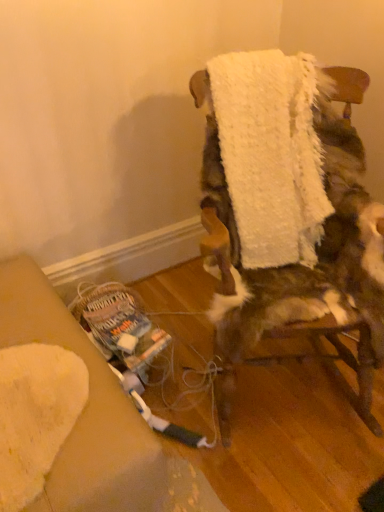
Identify the location of white fluffy chair at center. This screenshot has height=512, width=384. (299, 264).

Describe the element at coordinates (299, 264) in the screenshot. This screenshot has width=384, height=512. I see `white fluffy chair at center` at that location.

Describe the element at coordinates (271, 154) in the screenshot. This screenshot has width=384, height=512. I see `white fluffy towel at center` at that location.

Locate an element on the screen. The width and height of the screenshot is (384, 512). white fluffy towel at center is located at coordinates (271, 154).

Image resolution: width=384 pixels, height=512 pixels. In order to click on white fluffy chair at center in this screenshot , I will do `click(299, 264)`.

Is white fluffy chair at center to the left or to the right of white fluffy towel at center in the image?

From the image, it's evident that white fluffy chair at center is to the right of white fluffy towel at center.

Relative to white fluffy towel at center, is white fluffy chair at center in front or behind?

Clearly, white fluffy chair at center is in front of white fluffy towel at center.

Is point (326, 84) positioned before point (216, 78)?

No, it is behind (216, 78).

From the image's perspective, is white fluffy chair at center on top of white fluffy towel at center?

No, from the image's perspective, white fluffy chair at center is not above white fluffy towel at center.

From a real-world perspective, is white fluffy chair at center physically above white fluffy towel at center?

Actually, white fluffy chair at center is physically below white fluffy towel at center in the real world.

Between white fluffy chair at center and white fluffy towel at center, which one has larger width?

Wider between the two is white fluffy chair at center.

Between white fluffy chair at center and white fluffy towel at center, which one has more height?

white fluffy chair at center.

In the scene shown: Can you confirm if white fluffy chair at center is bigger than white fluffy towel at center?

Yes, white fluffy chair at center is bigger than white fluffy towel at center.

Would you say white fluffy chair at center is inside or outside white fluffy towel at center?

white fluffy chair at center is spatially situated outside white fluffy towel at center.

Are white fluffy chair at center and white fluffy towel at center beside each other?

No, white fluffy chair at center is not with white fluffy towel at center.

Is white fluffy towel at center at the back of white fluffy chair at center?

Yes, white fluffy chair at center's orientation is away from white fluffy towel at center.

How different are the orientations of white fluffy chair at center and white fluffy towel at center in degrees?

The angular difference between white fluffy chair at center and white fluffy towel at center is 2.82 degrees.

I want to click on bath towel above the white fluffy chair at center (from the image's perspective), so click(x=271, y=154).

Which object is positioned more to the right, white fluffy towel at center or white fluffy chair at center?

white fluffy chair at center.

Which object is closer to the camera taking this photo, white fluffy towel at center or white fluffy chair at center?

Positioned in front is white fluffy chair at center.

Does point (312, 105) come farther from viewer compared to point (238, 348)?

Yes, point (312, 105) is behind point (238, 348).

From the image's perspective, is white fluffy towel at center beneath white fluffy chair at center?

No.

From a real-world perspective, is white fluffy towel at center under white fluffy chair at center?

No, from a real-world perspective, white fluffy towel at center is not beneath white fluffy chair at center.

In the scene shown: Between white fluffy towel at center and white fluffy chair at center, which one has smaller width?

white fluffy towel at center is thinner.

Which of these two, white fluffy towel at center or white fluffy chair at center, stands shorter?

white fluffy towel at center is shorter.

Looking at the image, does white fluffy towel at center seem bigger or smaller compared to white fluffy chair at center?

In the image, white fluffy towel at center appears to be smaller than white fluffy chair at center.

In the scene shown: Could white fluffy chair at center be considered to be inside white fluffy towel at center?

No.

Would you say white fluffy towel at center is a long distance from white fluffy chair at center?

No, white fluffy towel at center is in close proximity to white fluffy chair at center.

Could you tell me if white fluffy towel at center is facing white fluffy chair at center?

Yes.

In the image, there is a white fluffy towel at center. In order to click on chair below it (from a real-world perspective) in this screenshot , I will do `click(299, 264)`.

Where is `chair on the right of white fluffy towel at center`? chair on the right of white fluffy towel at center is located at coordinates (299, 264).

Find the location of a particular element. chair that is below the white fluffy towel at center (from the image's perspective) is located at coordinates [299, 264].